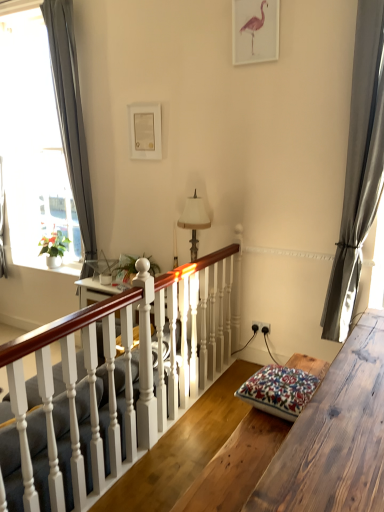
The height and width of the screenshot is (512, 384). I want to click on vacant space situated above floral-patterned fabric cushion at lower right (from a real-world perspective), so click(x=294, y=385).